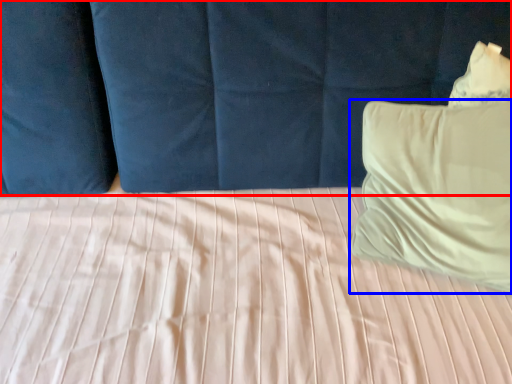
Question: Which object is closer to the camera taking this photo, curtain (highlighted by a red box) or pillow (highlighted by a blue box)?

Choices:
 (A) curtain
 (B) pillow

Answer: (A)